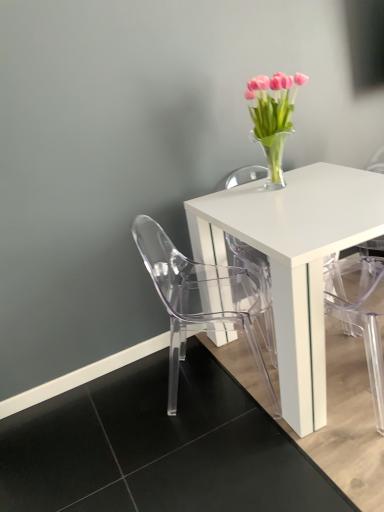
Identify the location of free space to the left of transparent plastic chair at lower left. This screenshot has height=512, width=384. 133,411.